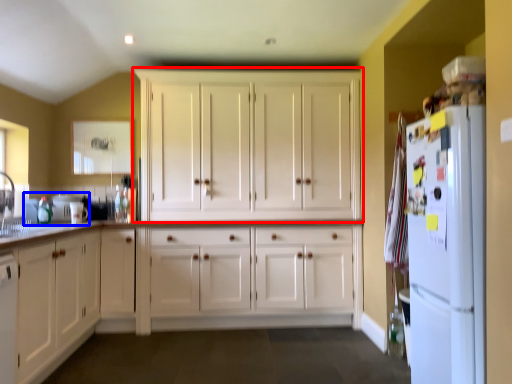
Question: Which point is further to the camera, cabinetry (highlighted by a red box) or sink (highlighted by a blue box)?

Choices:
 (A) cabinetry
 (B) sink

Answer: (B)